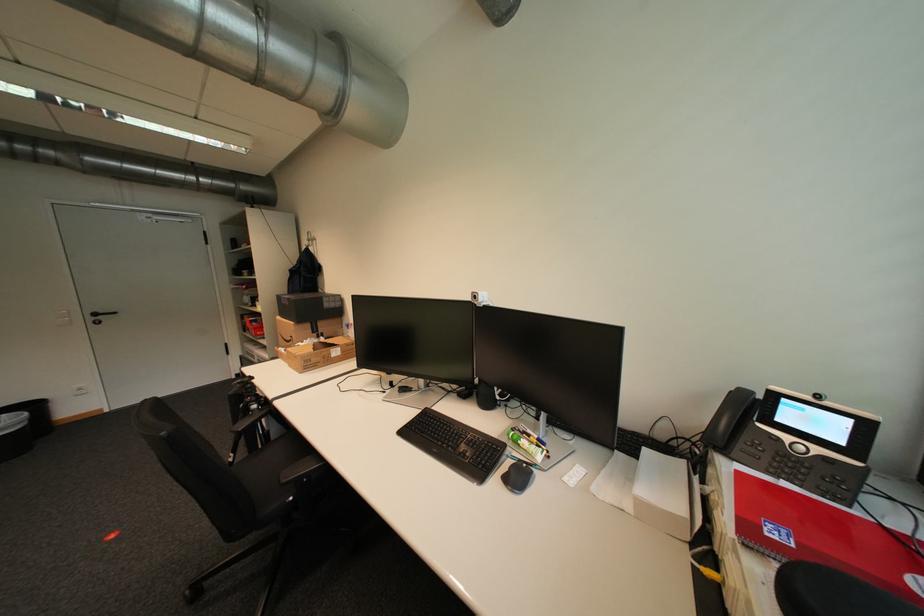
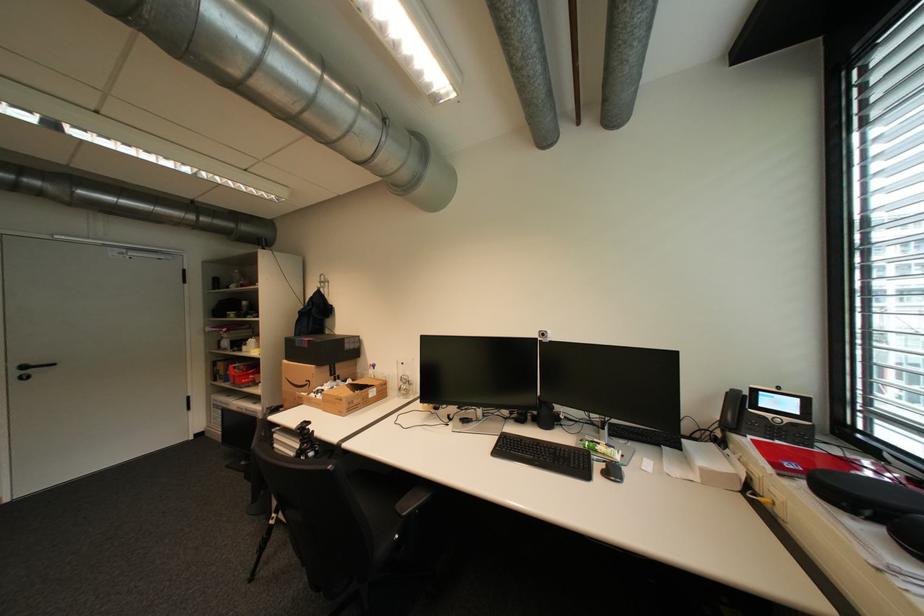
Locate, in the second image, the point that corresponds to [299,499] in the first image.

(406, 537)